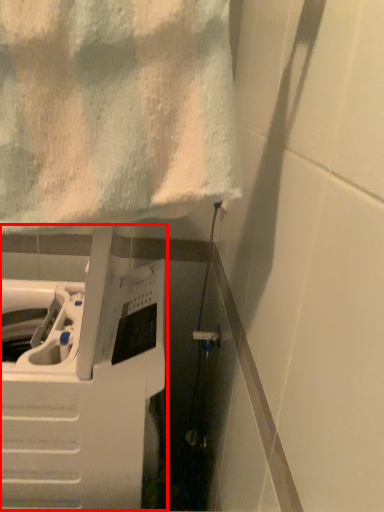
Question: From the image's perspective, considering the relative positions of appliance (annotated by the red box) and towel in the image provided, where is appliance (annotated by the red box) located with respect to the staircase?

Choices:
 (A) below
 (B) above

Answer: (A)